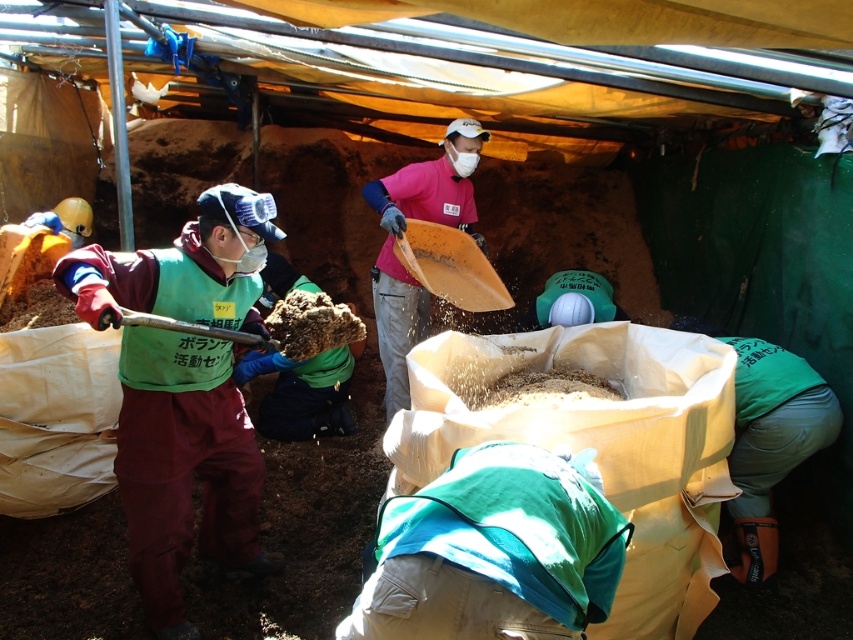
You are part of an archaeological team working under the tent. You need to place a marker at the exact center of the green fabric bag at lower right. What are the coordinates where you should place the marker?

The green fabric bag at lower right is located at point (x=769, y=436), so the marker should be placed at those coordinates to mark its center.

Based on the photo, you are a member of the excavation team and need to place a 1.2 meter long tool vertically in the space between the green fabric bag at lower right and the wooden shovel at center. Is there enough vertical space for it?

The green fabric bag at lower right is taller than the wooden shovel at center. Since the tool is 1.2 meters long and needs to be placed vertically between them, the height of the taller object, which is the green fabric bag at lower right, would determine the available space. If the bag is taller than the shovel, the vertical space between them might be sufficient, but without knowing the exact height of the bag or the distance between them, it is impossible to confirm. However, based on the given data, we

You are part of the archaeological team and need to place a tool next to the green fabric bag at lower right. Which object should you move closer to it, the wooden shovel at center or another object not shown?

You should move the wooden shovel at center closer to the green fabric bag at lower right because the green fabric bag is already closer to the viewer than the wooden shovel at center.